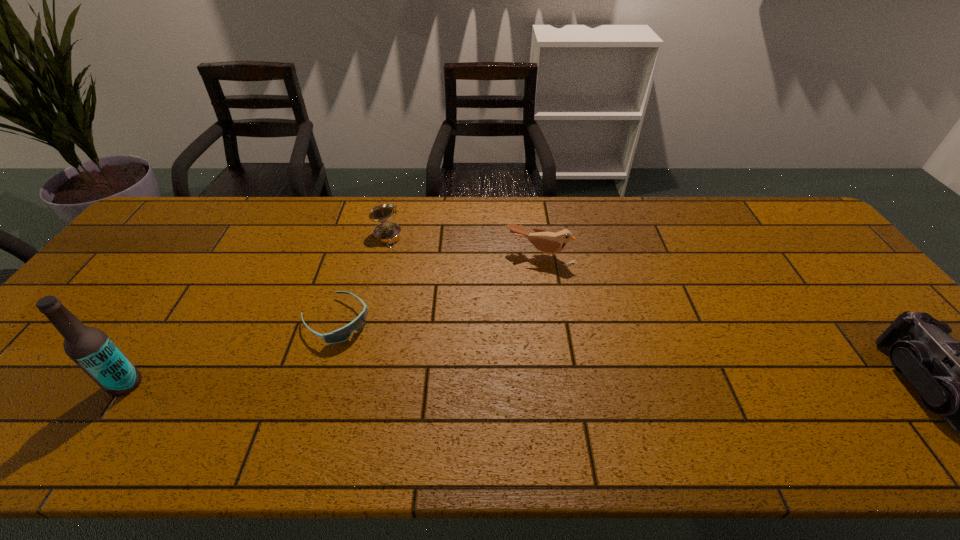
I want to click on vacant space on the desktop that is between the tallest object and the rightmost object and is positioned at the beak of the bird, so click(x=483, y=386).

The width and height of the screenshot is (960, 540). I want to click on free space on the desktop that is between the tallest object and the rightmost object and is positioned on the front-facing side of the shortest object, so click(409, 385).

The height and width of the screenshot is (540, 960). Identify the location of vacant spot on the desktop that is between the tallest object and the rightmost object and is positioned with the dial facing the compass. [436, 385].